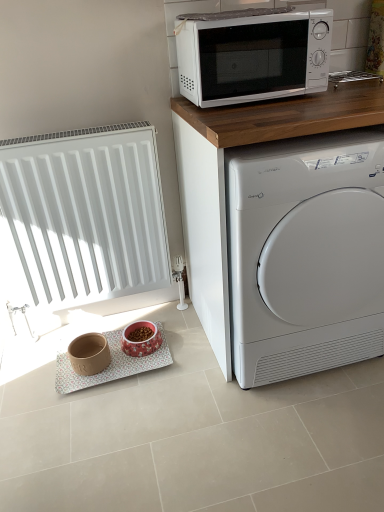
Image resolution: width=384 pixels, height=512 pixels. I want to click on vacant space to the right of matte brown bowl at lower left, marked as the 2th appliance in a right-to-left arrangement, so click(136, 370).